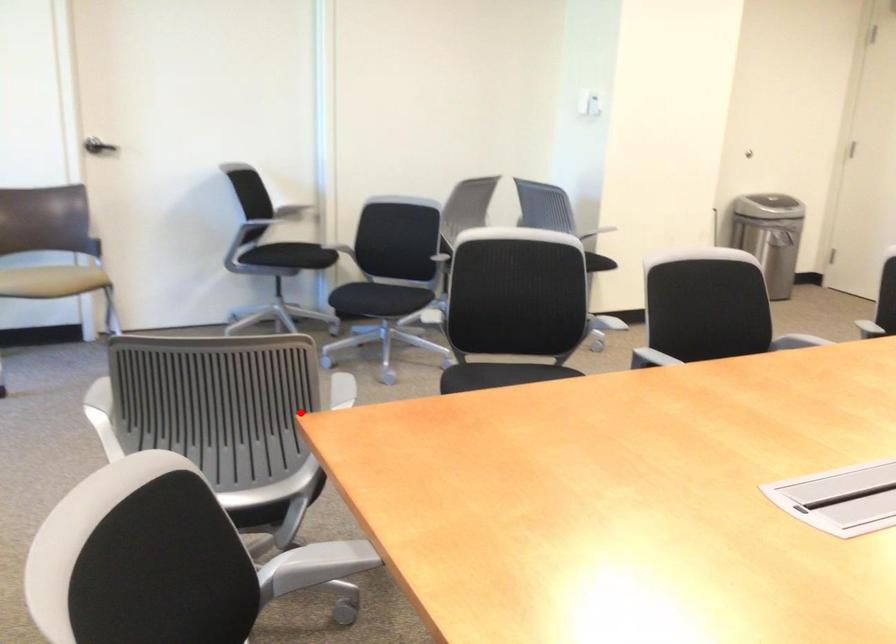
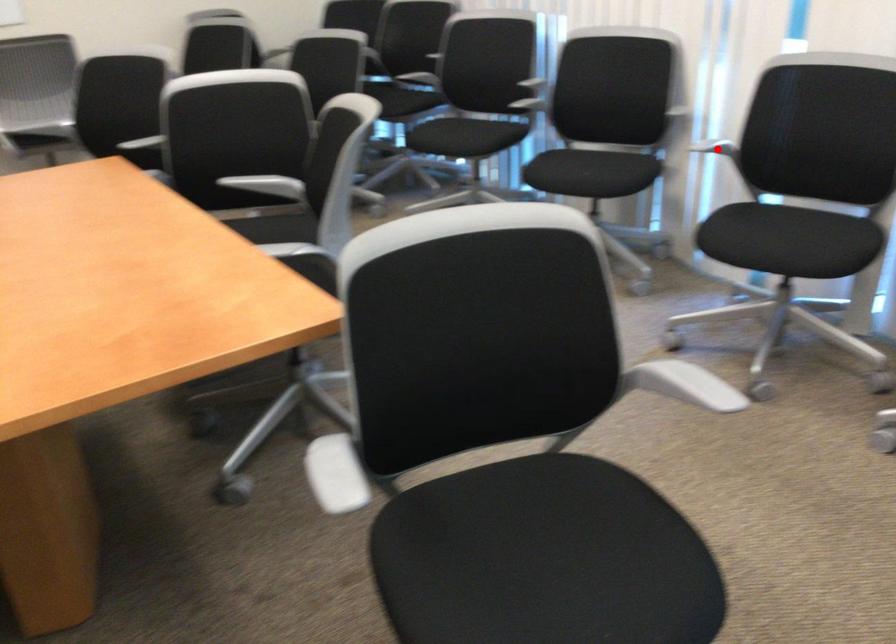
I am providing you with two images of the same scene from different viewpoints. A red point is marked on the first image and another point is marked on the second image. Is the red point in image1 aligned with the point shown in image2?

No